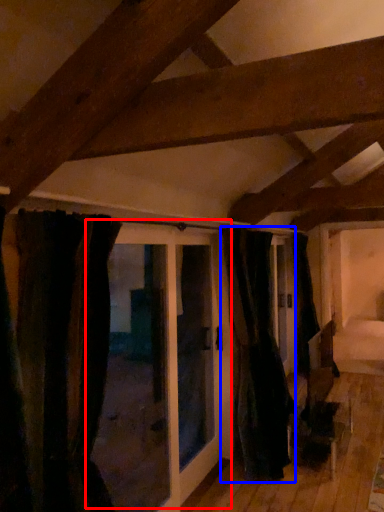
Question: Which object is closer to the camera taking this photo, door (highlighted by a red box) or curtain (highlighted by a blue box)?

Choices:
 (A) door
 (B) curtain

Answer: (A)